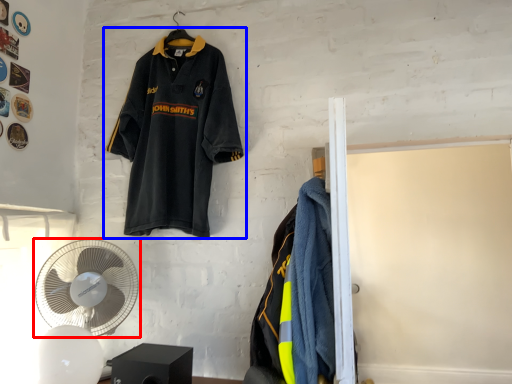
Question: Which point is closer to the camera, mechanical fan (highlighted by a red box) or sports uniform (highlighted by a blue box)?

Choices:
 (A) mechanical fan
 (B) sports uniform

Answer: (A)